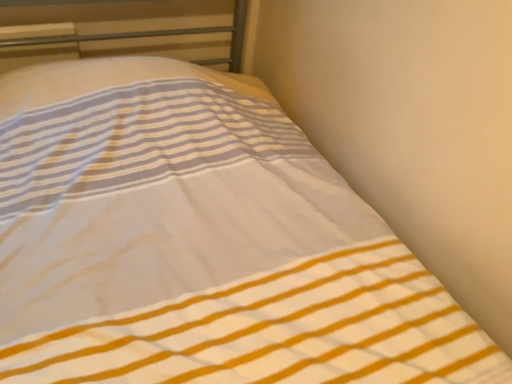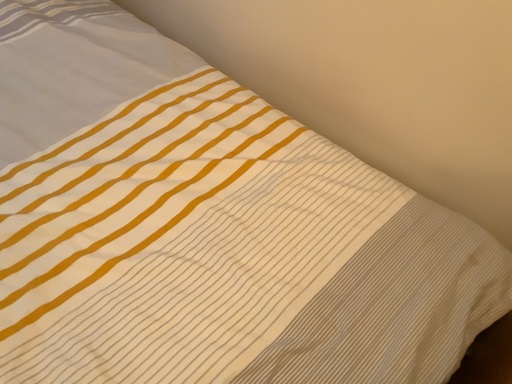
Question: How did the camera likely rotate when shooting the video?

Choices:
 (A) rotated right
 (B) rotated left

Answer: (A)